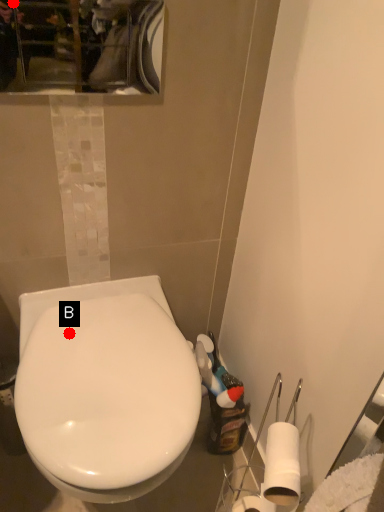
Question: Two points are circled on the image, labeled by A and B beside each circle. Which of the following is the farthest from the observer?

Choices:
 (A) A is further
 (B) B is further

Answer: (A)